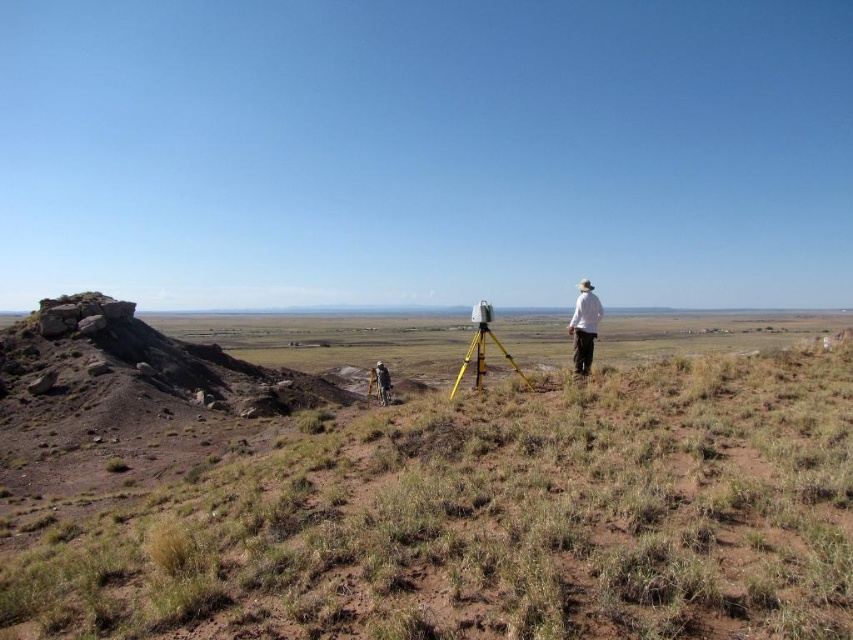
Question: Is white matte shirt at right further to camera compared to brushed metal tripod at lower center?

Choices:
 (A) yes
 (B) no

Answer: (B)

Question: Which object appears closest to the camera in this image?

Choices:
 (A) yellow metallic tripod at center
 (B) white matte shirt at right

Answer: (A)

Question: Considering the real-world distances, which object is farthest from the white matte shirt at right?

Choices:
 (A) dry grass at center
 (B) yellow metallic tripod at center

Answer: (B)

Question: Does dry grass at center appear over white matte shirt at right?

Choices:
 (A) no
 (B) yes

Answer: (A)

Question: Which point is farther to the camera?

Choices:
 (A) coord(474,352)
 (B) coord(576,337)
 (C) coord(387,394)
 (D) coord(792,509)

Answer: (C)

Question: Is dry grass at center positioned at the back of brushed metal tripod at lower center?

Choices:
 (A) no
 (B) yes

Answer: (A)